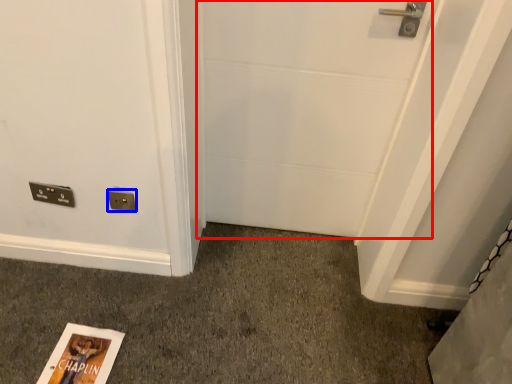
Question: Which object is further to the camera taking this photo, door (highlighted by a red box) or electric outlet (highlighted by a blue box)?

Choices:
 (A) door
 (B) electric outlet

Answer: (B)